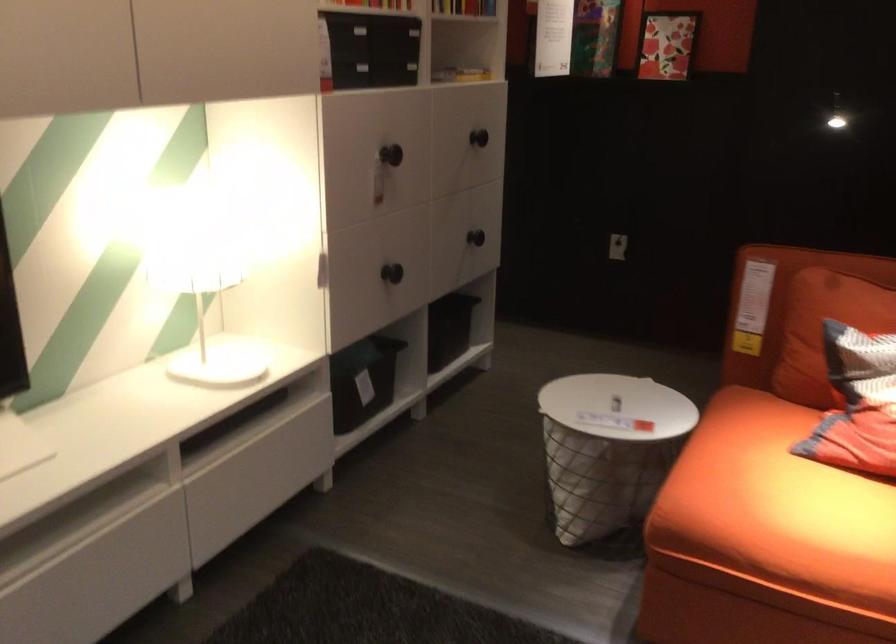
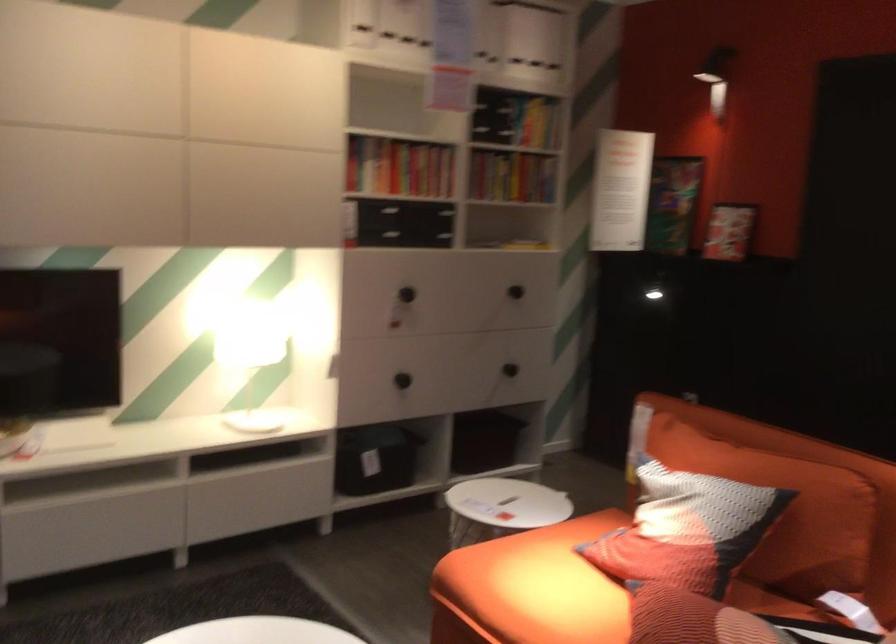
The point at (x=807, y=512) is marked in the first image. Where is the corresponding point in the second image?

(531, 588)